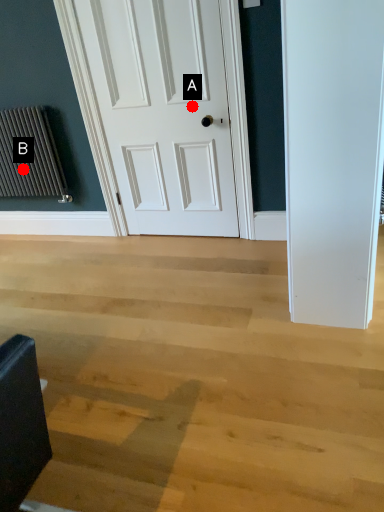
Question: Two points are circled on the image, labeled by A and B beside each circle. Which point is closer to the camera?

Choices:
 (A) A is closer
 (B) B is closer

Answer: (A)